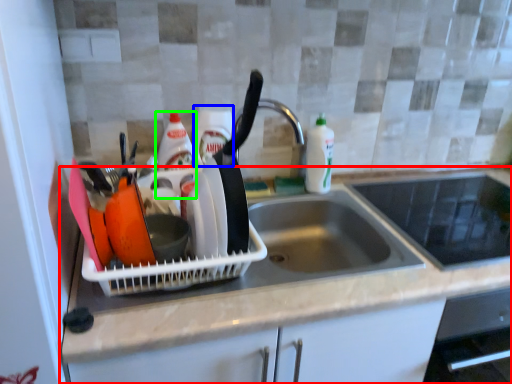
Question: Based on their relative distances, which object is nearer to countertop (highlighted by a red box)? Choose from bottle (highlighted by a blue box) and bottle (highlighted by a green box).

Choices:
 (A) bottle
 (B) bottle

Answer: (A)